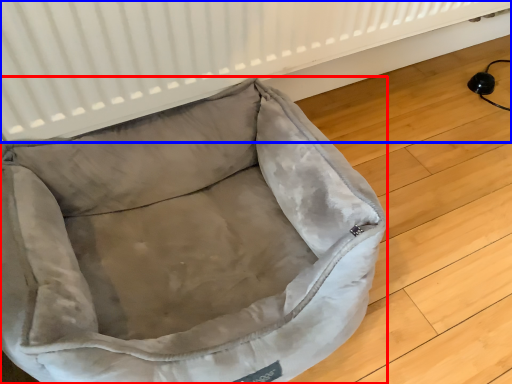
Question: Which point is closer to the camera, dog bed (highlighted by a red box) or radiator (highlighted by a blue box)?

Choices:
 (A) dog bed
 (B) radiator

Answer: (A)